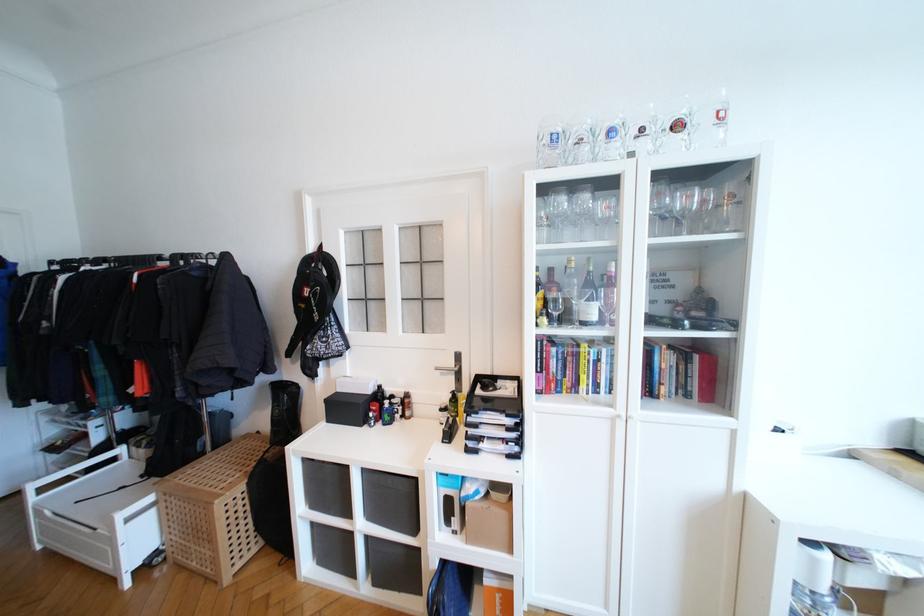
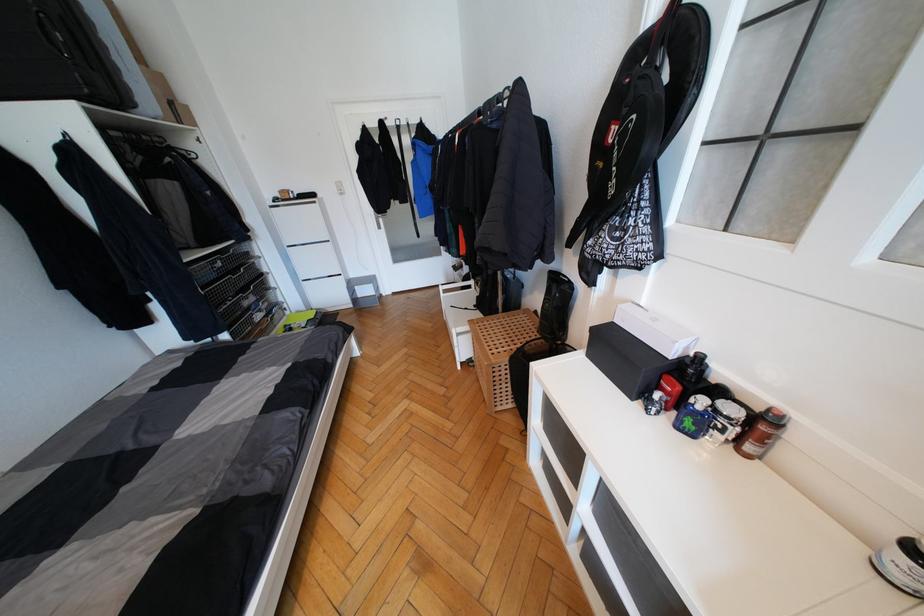
Find the pixel in the second image that matches the point at 373,411 in the first image.

(663, 389)